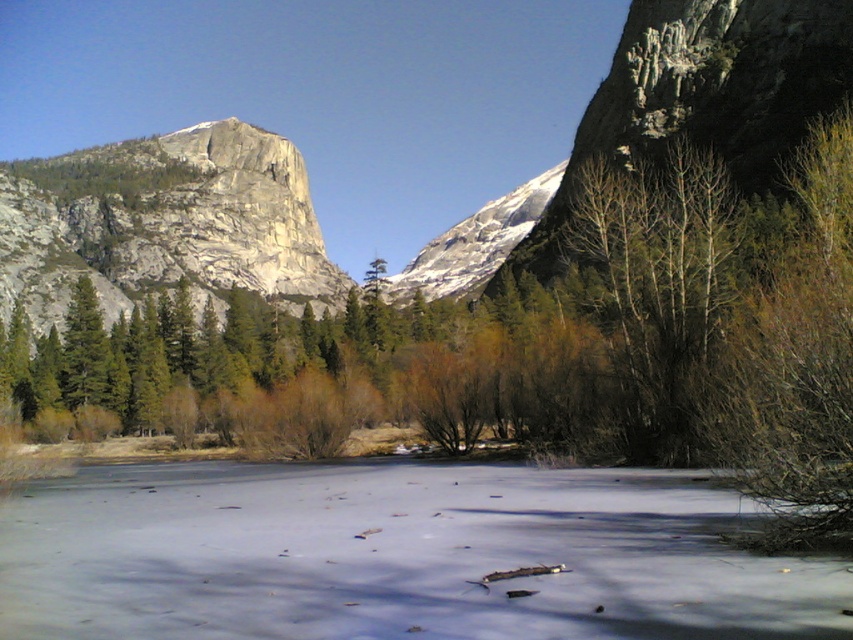
Question: Is frozen ice at center to the right of granite cliff at left from the viewer's perspective?

Choices:
 (A) no
 (B) yes

Answer: (B)

Question: Which object appears closest to the camera in this image?

Choices:
 (A) frozen ice at center
 (B) granite cliff at left

Answer: (A)

Question: Does frozen ice at center have a lesser width compared to granite cliff at left?

Choices:
 (A) no
 (B) yes

Answer: (B)

Question: Which point is farther to the camera?

Choices:
 (A) frozen ice at center
 (B) granite cliff at left

Answer: (B)

Question: Can you confirm if frozen ice at center is positioned to the left of granite cliff at left?

Choices:
 (A) yes
 (B) no

Answer: (B)